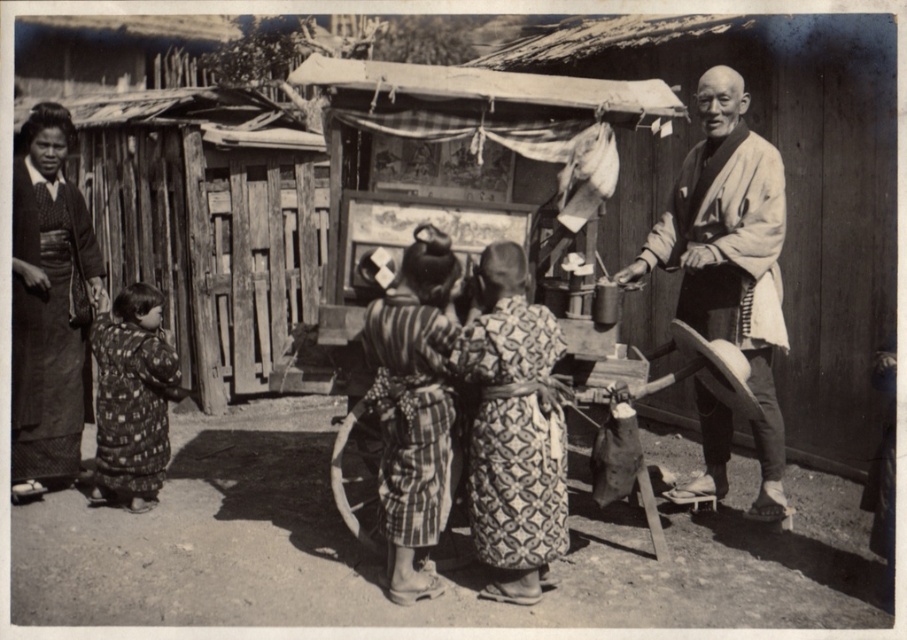
Does white cotton kimono at right have a lesser height compared to patterned fabric kimono at center?

No.

Image resolution: width=907 pixels, height=640 pixels. What do you see at coordinates (730, 257) in the screenshot?
I see `white cotton kimono at right` at bounding box center [730, 257].

Is point (688, 177) behind point (481, 520)?

That is True.

This screenshot has height=640, width=907. Find the location of `white cotton kimono at right`. white cotton kimono at right is located at coordinates (730, 257).

Who is taller, striped fabric kimono at center or printed fabric dress at left?

Standing taller between the two is striped fabric kimono at center.

Between striped fabric kimono at center and printed fabric dress at left, which one has less height?

With less height is printed fabric dress at left.

Find the location of a particular element. striped fabric kimono at center is located at coordinates (413, 408).

What do you see at coordinates (514, 429) in the screenshot? I see `patterned fabric kimono at center` at bounding box center [514, 429].

Who is lower down, patterned fabric kimono at center or striped fabric kimono at center?

patterned fabric kimono at center is below.

You are a GUI agent. You are given a task and a screenshot of the screen. Output one action in this format:
    pyautogui.click(x=<x>, y=<y>)
    Task: Click on the patterned fabric kimono at center
    This screenshot has height=640, width=907.
    Given the screenshot: What is the action you would take?
    pyautogui.click(x=514, y=429)

Identify the location of patterned fabric kimono at center. (514, 429).